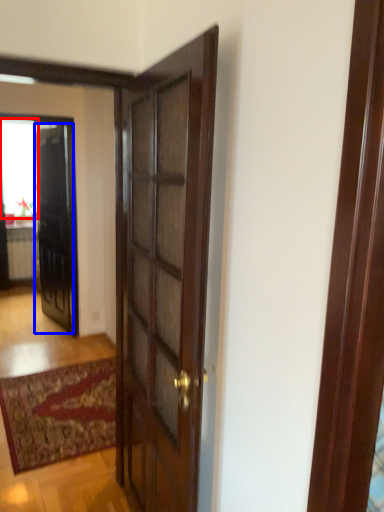
Question: Which object is closer to the camera taking this photo, window (highlighted by a red box) or door (highlighted by a blue box)?

Choices:
 (A) window
 (B) door

Answer: (B)